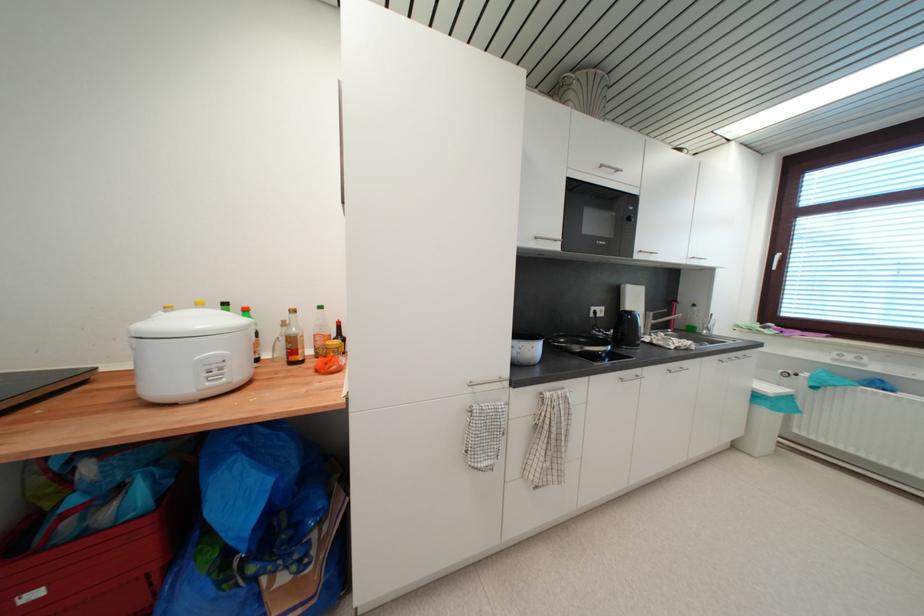
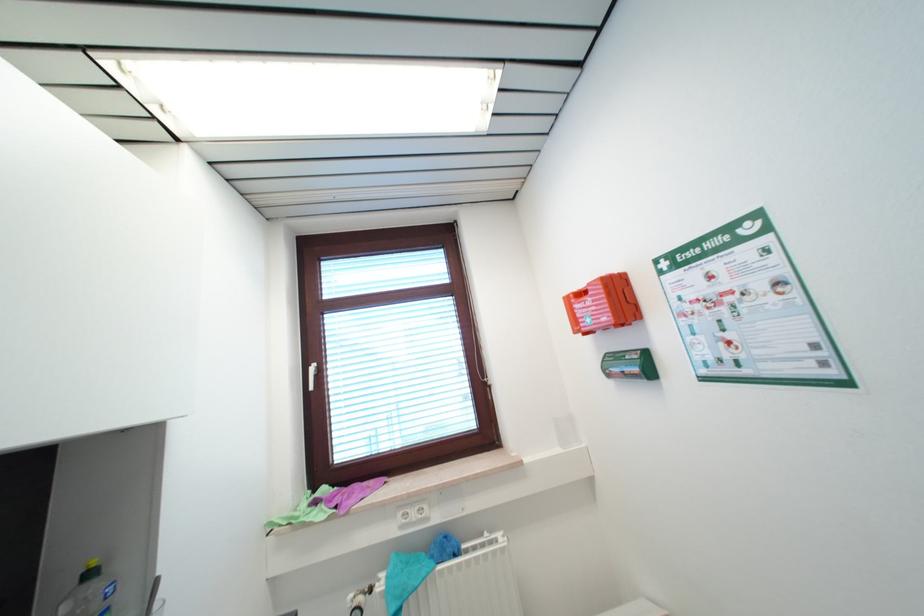
The point at (x=810, y=377) is marked in the first image. Where is the corresponding point in the second image?

(385, 589)